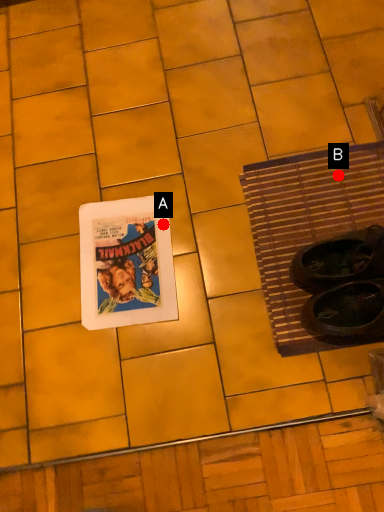
Question: Two points are circled on the image, labeled by A and B beside each circle. Which point is closer to the camera?

Choices:
 (A) A is closer
 (B) B is closer

Answer: (B)